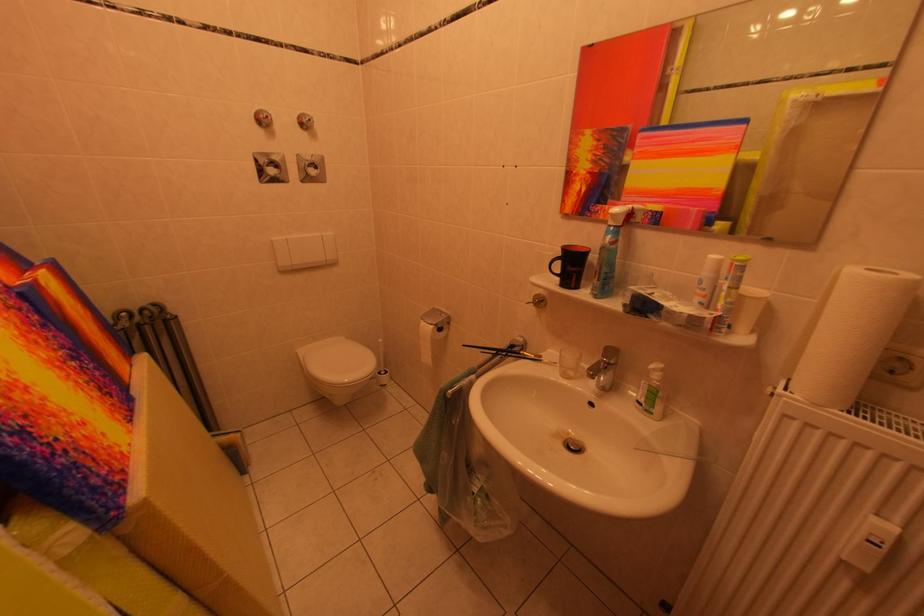
Describe the element at coordinates (749, 310) in the screenshot. I see `the aerosol can cap` at that location.